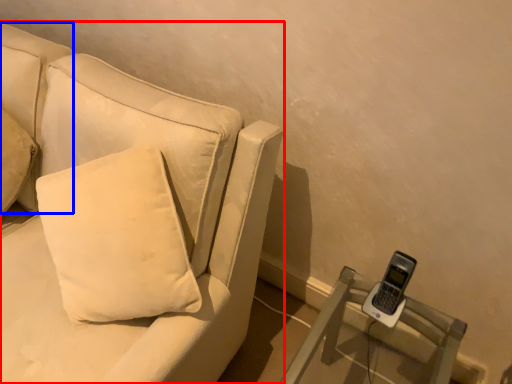
Question: Among these objects, which one is farthest to the camera, studio couch (highlighted by a red box) or pillow (highlighted by a blue box)?

Choices:
 (A) studio couch
 (B) pillow

Answer: (B)